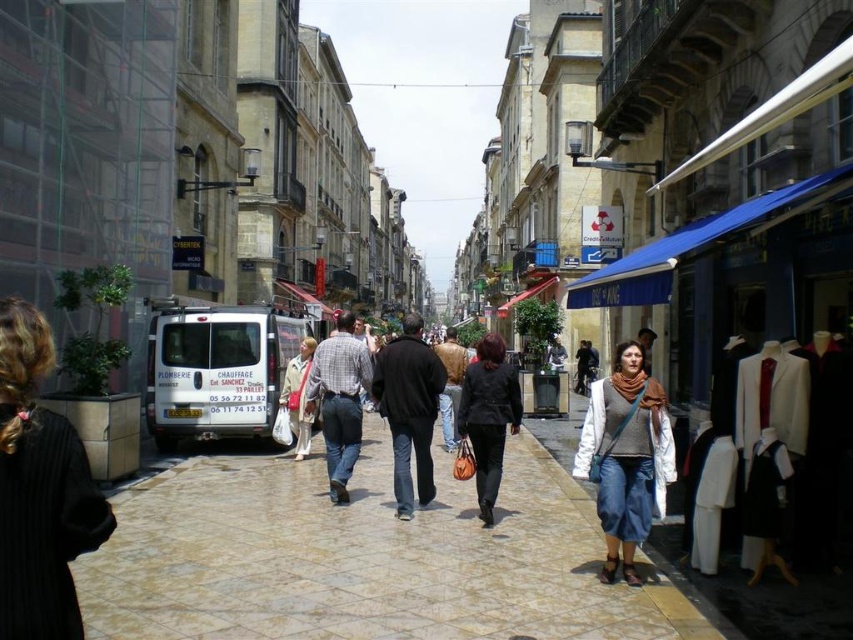
In the scene shown: You are a delivery person who needs to place a light beige coat at center onto the light beige stone pavement at center. Given that the coat is 4 feet wide, can you fit it on the pavement without overlapping?

The light beige stone pavement at center and light beige coat at center are 34.34 feet apart from each other. Since the coat is only 4 feet wide, there is sufficient space between them to place the coat on the pavement without overlapping.

You are a delivery person standing at the edge of the light beige stone pavement at center and need to reach the black wool coat at lower left. Which direction should you move to get closer to the coat?

You should move backward because the light beige stone pavement at center is further away from you than the black wool coat at lower left, meaning the coat is closer to your current position.